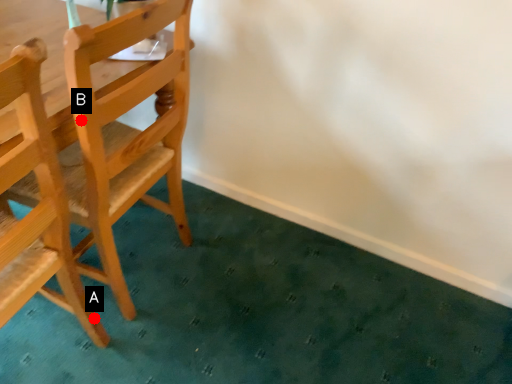
Question: Two points are circled on the image, labeled by A and B beside each circle. Which point is farther from the camera taking this photo?

Choices:
 (A) A is further
 (B) B is further

Answer: (A)